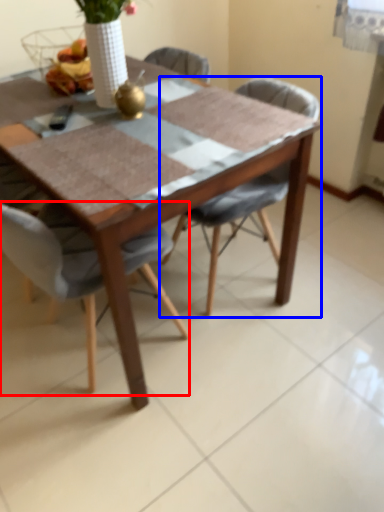
Question: Which point is further to the camera, chair (highlighted by a red box) or chair (highlighted by a blue box)?

Choices:
 (A) chair
 (B) chair

Answer: (B)